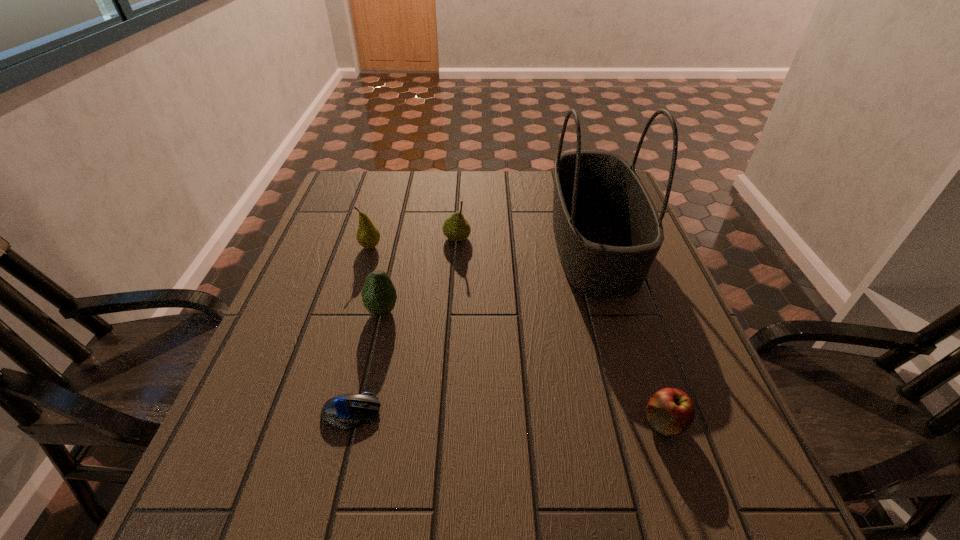
Find the location of a particular element. This screenshot has width=960, height=540. basket is located at coordinates (608, 232).

I want to click on the left pear, so click(368, 236).

Where is `the right pear`? This screenshot has width=960, height=540. the right pear is located at coordinates (x=456, y=228).

This screenshot has width=960, height=540. I want to click on avocado, so click(379, 296).

This screenshot has width=960, height=540. In order to click on apple in this screenshot , I will do `click(670, 411)`.

Where is `computer mouse`? This screenshot has height=540, width=960. computer mouse is located at coordinates (344, 411).

The width and height of the screenshot is (960, 540). What are the coordinates of `vacant area located on the front of the tallest object` in the screenshot? It's located at (623, 340).

At what (x,y) coordinates should I click in order to perform the action: click on blank space located on the back of the left pear. Please return your answer as a coordinate pair (x, y). Looking at the image, I should click on (375, 230).

The image size is (960, 540). Find the location of `vacant space located on the right of the right pear`. vacant space located on the right of the right pear is located at coordinates (529, 238).

Find the location of a particular element. This screenshot has width=960, height=540. blank space located 0.320m on the back of the avocado is located at coordinates (402, 221).